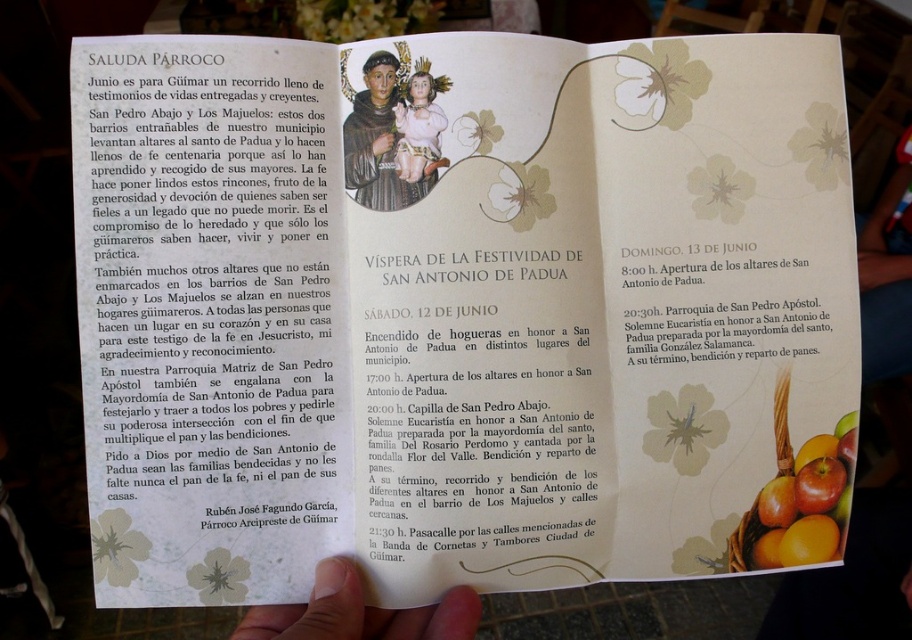
Question: Is flesh-toned skin at lower center below shiny red apples at lower right?

Choices:
 (A) no
 (B) yes

Answer: (B)

Question: Considering the real-world distances, which object is closest to the matte black saint at upper center?

Choices:
 (A) shiny red apples at lower right
 (B) matte porcelain baby at upper center
 (C) flesh-toned skin at lower center

Answer: (B)

Question: Can you confirm if matte black saint at upper center is smaller than shiny red apples at lower right?

Choices:
 (A) yes
 (B) no

Answer: (B)

Question: Does matte black saint at upper center have a larger size compared to shiny red apples at lower right?

Choices:
 (A) yes
 (B) no

Answer: (A)

Question: Which point appears farthest from the camera in this image?

Choices:
 (A) (329, 602)
 (B) (430, 161)

Answer: (B)

Question: Which object is farther from the camera taking this photo?

Choices:
 (A) shiny red apples at lower right
 (B) flesh-toned skin at lower center

Answer: (A)